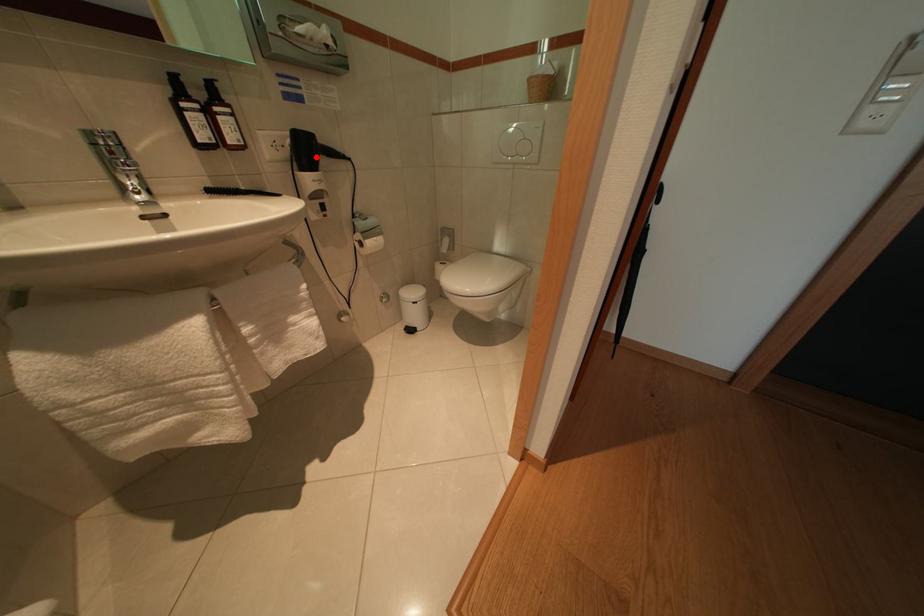
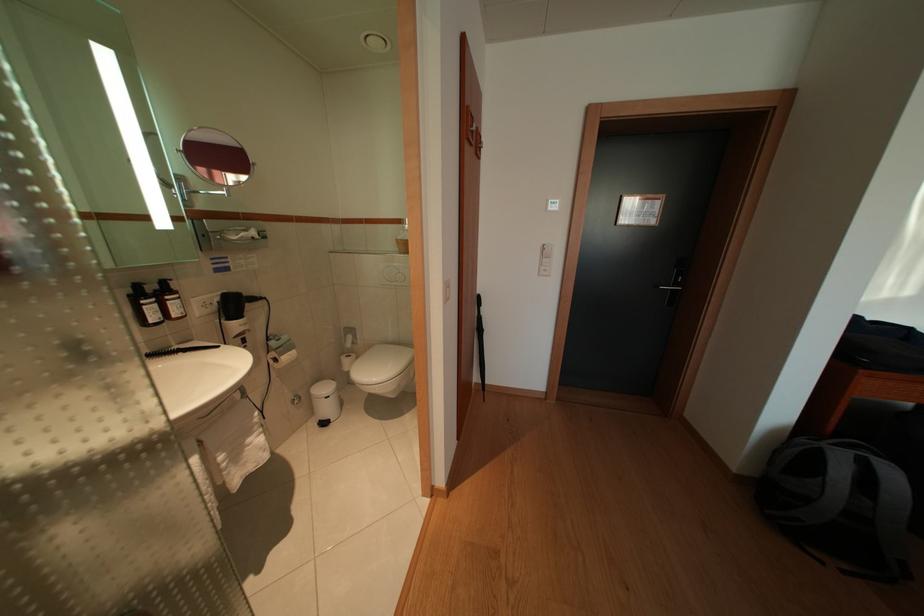
Where in the second image is the point corresponding to the highlighted location from the first image?

(242, 310)